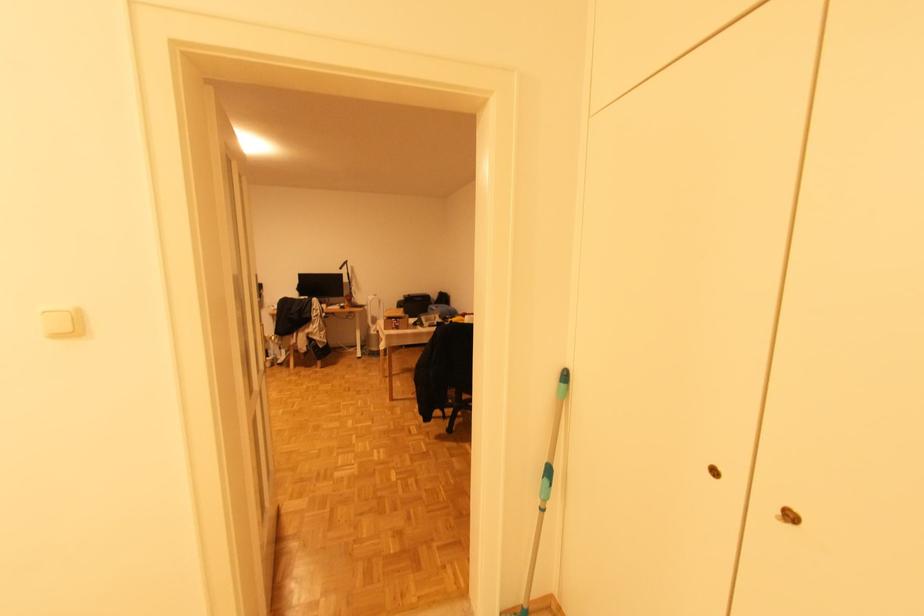
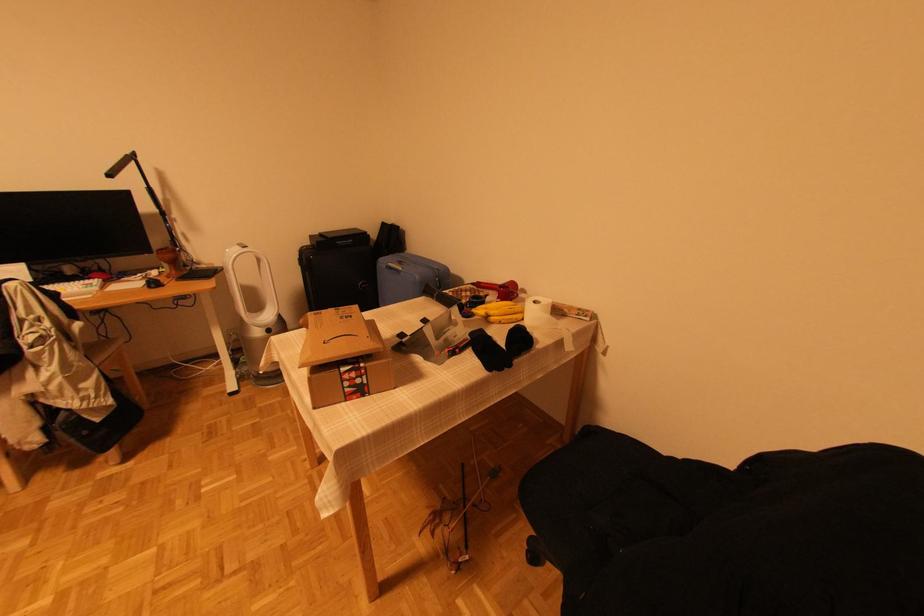
Where in the second image is the point corresponding to point 353,283 from the first image?

(166, 215)